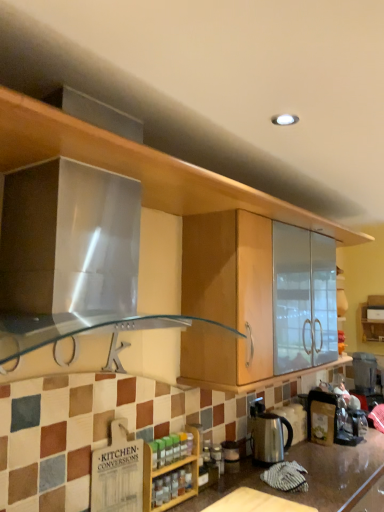
Find the location of a particular element. wooden cutting board at lower center is located at coordinates (255, 503).

Considering the sizes of objects wooden spice rack at lower center and polished stainless steel kettle at center in the image provided, who is taller, wooden spice rack at lower center or polished stainless steel kettle at center?

With more height is wooden spice rack at lower center.

At what (x,y) coordinates should I click in order to perform the action: click on cabinetry in front of the polished stainless steel kettle at center. Please return your answer as a coordinate pair (x, y). Image resolution: width=384 pixels, height=512 pixels. Looking at the image, I should click on (170, 472).

From the image's perspective, which is below, wooden spice rack at lower center or polished stainless steel kettle at center?

polished stainless steel kettle at center appears lower in the image.

Considering the sizes of wooden spice rack at lower center and polished stainless steel kettle at center in the image, is wooden spice rack at lower center wider or thinner than polished stainless steel kettle at center?

Considering their sizes, wooden spice rack at lower center looks slimmer than polished stainless steel kettle at center.

How far apart are wooden cutting board at lower center and polished stainless steel kettle at center?

A distance of 13.50 inches exists between wooden cutting board at lower center and polished stainless steel kettle at center.

Which of these two, wooden cutting board at lower center or polished stainless steel kettle at center, stands shorter?

With less height is wooden cutting board at lower center.

Identify the location of table lying below the polished stainless steel kettle at center (from the image's perspective). (255, 503).

Is wooden cutting board at lower center in contact with polished stainless steel kettle at center?

No, wooden cutting board at lower center is not in contact with polished stainless steel kettle at center.

Is wooden spice rack at lower center wider than wooden cutting board at lower center?

No, wooden spice rack at lower center is not wider than wooden cutting board at lower center.

From the image's perspective, is wooden spice rack at lower center beneath wooden cutting board at lower center?

No, from the image's perspective, wooden spice rack at lower center is not below wooden cutting board at lower center.

Who is more distant, wooden spice rack at lower center or wooden cutting board at lower center?

wooden spice rack at lower center is further from the camera.

Which of these two, wooden spice rack at lower center or wooden cutting board at lower center, is bigger?

wooden spice rack at lower center is bigger.

Does wooden cutting board at lower center have a lesser width compared to wooden spice rack at lower center?

Incorrect, the width of wooden cutting board at lower center is not less than that of wooden spice rack at lower center.

From the image's perspective, is wooden cutting board at lower center over wooden spice rack at lower center?

No.

Visually, is wooden cutting board at lower center positioned to the left or to the right of wooden spice rack at lower center?

Clearly, wooden cutting board at lower center is on the right of wooden spice rack at lower center in the image.

Is wooden cutting board at lower center inside polished stainless steel kettle at center?

No, wooden cutting board at lower center is not inside polished stainless steel kettle at center.

Measure the distance between polished stainless steel kettle at center and wooden cutting board at lower center.

A distance of 34.29 centimeters exists between polished stainless steel kettle at center and wooden cutting board at lower center.

Is polished stainless steel kettle at center smaller than wooden cutting board at lower center?

Incorrect, polished stainless steel kettle at center is not smaller in size than wooden cutting board at lower center.

Is polished stainless steel kettle at center inside the boundaries of wooden spice rack at lower center, or outside?

polished stainless steel kettle at center is spatially situated outside wooden spice rack at lower center.

From a real-world perspective, who is located higher, polished stainless steel kettle at center or wooden spice rack at lower center?

From a 3D spatial view, wooden spice rack at lower center is above.

Can you tell me how much polished stainless steel kettle at center and wooden spice rack at lower center differ in facing direction?

They differ by 2.04 degrees in their facing directions.

Considering the points (276, 441) and (179, 494), which point is behind, point (276, 441) or point (179, 494)?

The point (276, 441) is farther from the camera.

At what (x,y) coordinates should I click in order to perform the action: click on appliance that is under the wooden spice rack at lower center (from a real-world perspective). Please return your answer as a coordinate pair (x, y). Looking at the image, I should click on (267, 435).

This screenshot has width=384, height=512. I want to click on table below the polished stainless steel kettle at center (from the image's perspective), so click(255, 503).

Based on their spatial positions, is wooden spice rack at lower center or polished stainless steel kettle at center closer to wooden cutting board at lower center?

Based on the image, wooden spice rack at lower center appears to be nearer to wooden cutting board at lower center.

Based on their spatial positions, is polished stainless steel kettle at center or wooden spice rack at lower center closer to wooden cutting board at lower center?

wooden spice rack at lower center is closer to wooden cutting board at lower center.

Considering their positions, is polished stainless steel kettle at center positioned closer to wooden spice rack at lower center than wooden cutting board at lower center?

wooden cutting board at lower center.

Which object lies nearer to the anchor point polished stainless steel kettle at center, wooden spice rack at lower center or wooden cutting board at lower center?

The object closer to polished stainless steel kettle at center is wooden cutting board at lower center.

Based on their spatial positions, is wooden cutting board at lower center or polished stainless steel kettle at center further from wooden spice rack at lower center?

Among the two, polished stainless steel kettle at center is located further to wooden spice rack at lower center.

Looking at the image, which one is located closer to polished stainless steel kettle at center, wooden cutting board at lower center or wooden spice rack at lower center?

wooden cutting board at lower center is positioned closer to the anchor polished stainless steel kettle at center.

You are a GUI agent. You are given a task and a screenshot of the screen. Output one action in this format:
    pyautogui.click(x=<x>, y=<y>)
    Task: Click on the cabinetry located between wooden cutting board at lower center and polished stainless steel kettle at center in the depth direction
    This screenshot has width=384, height=512.
    Given the screenshot: What is the action you would take?
    pyautogui.click(x=170, y=472)